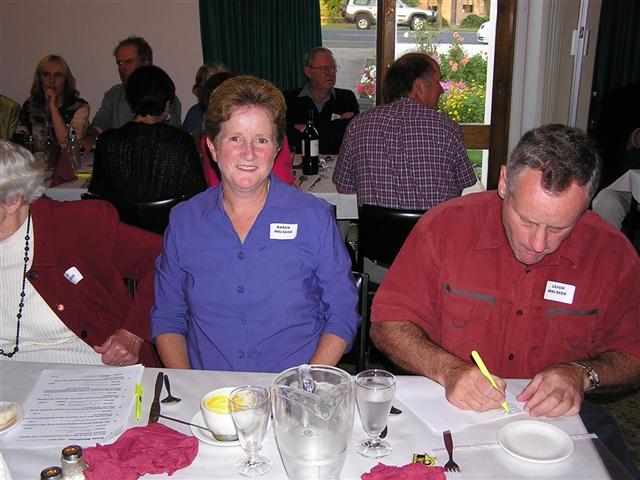
Find the location of `spoons`. spoons is located at coordinates (172, 398), (225, 439).